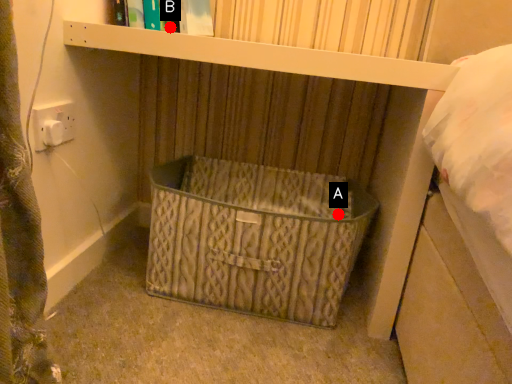
Question: Two points are circled on the image, labeled by A and B beside each circle. Which point is closer to the camera?

Choices:
 (A) A is closer
 (B) B is closer

Answer: (A)